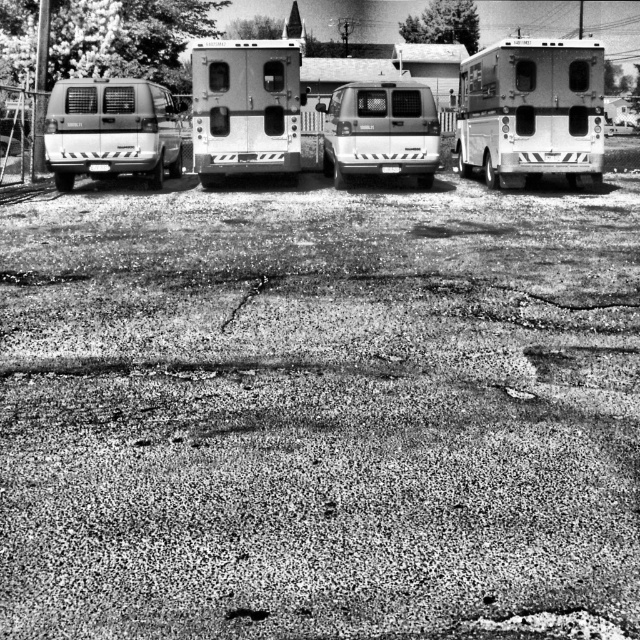
Question: Which object appears farthest from the camera in this image?

Choices:
 (A) white matte van at center
 (B) metallic silver camper at right
 (C) metallic silver camper at center

Answer: (A)

Question: Considering the relative positions of matte white van at left and white matte van at center in the image provided, where is matte white van at left located with respect to white matte van at center?

Choices:
 (A) above
 (B) below

Answer: (B)

Question: Can you confirm if metallic silver camper at center is bigger than white matte van at center?

Choices:
 (A) no
 (B) yes

Answer: (B)

Question: Which point is closer to the camera?

Choices:
 (A) metallic silver camper at right
 (B) metallic silver camper at center
 (C) matte white van at left
 (D) white matte van at center

Answer: (B)

Question: Does metallic silver camper at center have a larger size compared to matte white van at left?

Choices:
 (A) no
 (B) yes

Answer: (B)

Question: Among these objects, which one is nearest to the camera?

Choices:
 (A) white matte van at center
 (B) matte white van at left
 (C) metallic silver camper at center

Answer: (C)